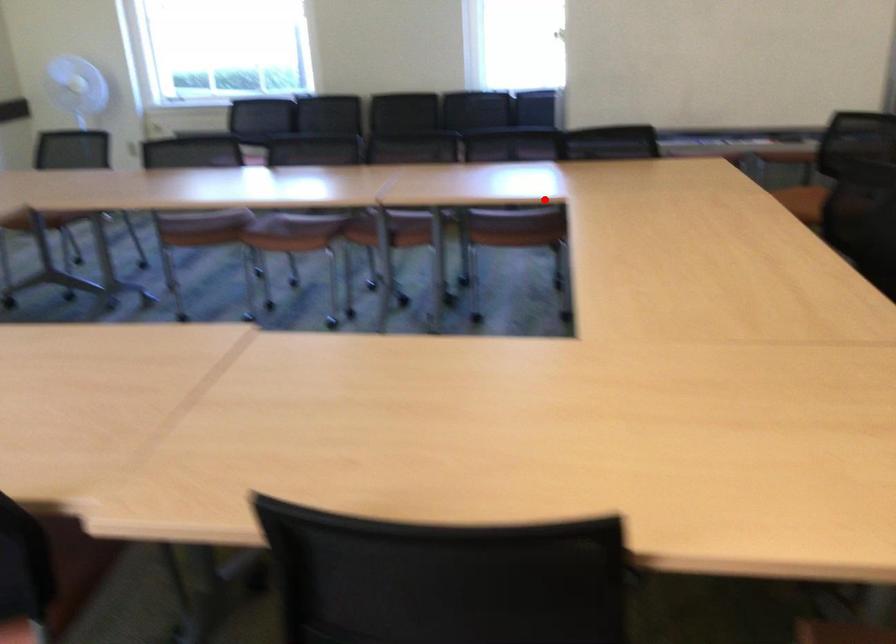
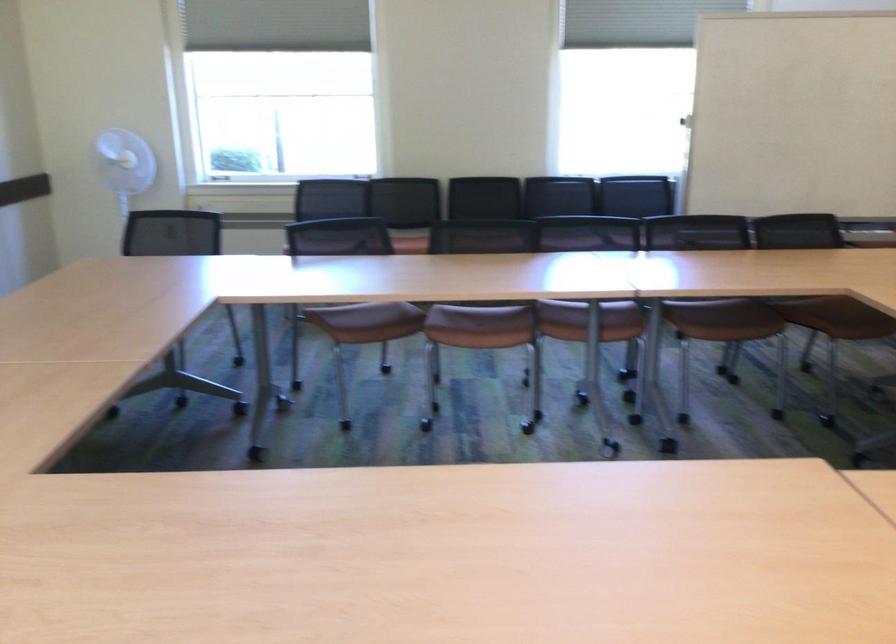
Question: I am providing you with two images of the same scene from different viewpoints. A red point is shown in image1. For the corresponding object point in image2, is it positioned nearer or farther from the camera?

Choices:
 (A) Nearer
 (B) Farther

Answer: (A)